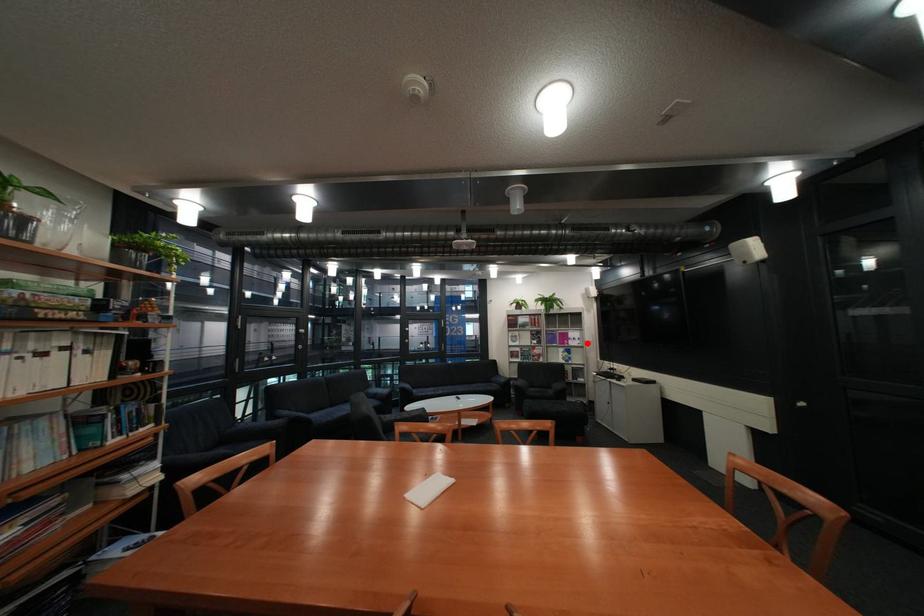
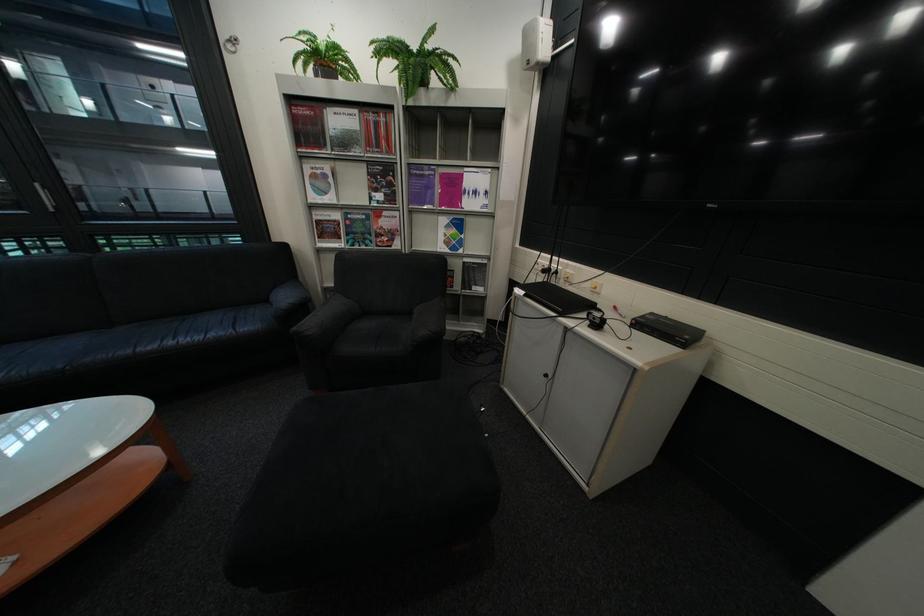
The point at the highlighted location is marked in the first image. Where is the corresponding point in the second image?

(484, 204)